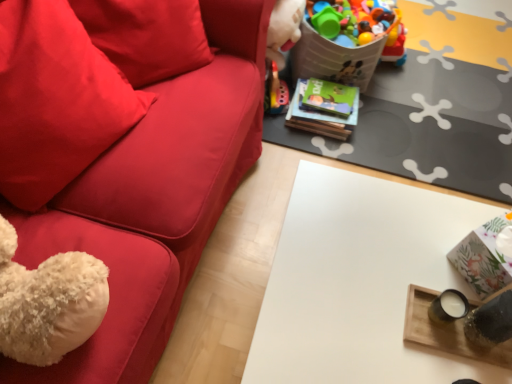
The height and width of the screenshot is (384, 512). What do you see at coordinates (360, 282) in the screenshot? I see `white glossy table at center` at bounding box center [360, 282].

You are a GUI agent. You are given a task and a screenshot of the screen. Output one action in this format:
    pyautogui.click(x=<x>, y=<y>)
    Task: Click on the white glossy table at center
    The height and width of the screenshot is (384, 512).
    Given the screenshot: What is the action you would take?
    pyautogui.click(x=360, y=282)

Where is `velvety red pillow at left`? This screenshot has height=384, width=512. velvety red pillow at left is located at coordinates (55, 100).

The height and width of the screenshot is (384, 512). What do you see at coordinates (55, 100) in the screenshot? I see `velvety red pillow at left` at bounding box center [55, 100].

Measure the distance between velvety red pillow at left and camera.

35.15 inches.

Find the location of a particular element. white glossy table at center is located at coordinates (360, 282).

Considering the relative positions of velvety red pillow at left and white glossy table at center in the image provided, is velvety red pillow at left to the left or to the right of white glossy table at center?

Based on their positions, velvety red pillow at left is located to the left of white glossy table at center.

Between velvety red pillow at left and white glossy table at center, which one is positioned behind?

white glossy table at center.

Considering the positions of point (103, 87) and point (471, 293), is point (103, 87) closer or farther from the camera than point (471, 293)?

Point (103, 87) is farther from the camera than point (471, 293).

From the image's perspective, which one is positioned higher, velvety red pillow at left or white glossy table at center?

velvety red pillow at left is shown above in the image.

From a real-world perspective, between velvety red pillow at left and white glossy table at center, who is vertically higher?

In real-world perspective, velvety red pillow at left is above.

In the scene shown: Considering the sizes of velvety red pillow at left and white glossy table at center in the image, is velvety red pillow at left wider or thinner than white glossy table at center?

In the image, velvety red pillow at left appears to be more narrow than white glossy table at center.

Considering the sizes of velvety red pillow at left and white glossy table at center in the image, is velvety red pillow at left taller or shorter than white glossy table at center?

In the image, velvety red pillow at left appears to be shorter than white glossy table at center.

Which of these two, velvety red pillow at left or white glossy table at center, is smaller?

Smaller between the two is velvety red pillow at left.

Is velvety red pillow at left positioned beyond the bounds of white glossy table at center?

velvety red pillow at left is positioned outside white glossy table at center.

In the scene shown: Is velvety red pillow at left not near white glossy table at center?

No, there isn't a large distance between velvety red pillow at left and white glossy table at center.

Is velvety red pillow at left facing towards white glossy table at center?

Yes, velvety red pillow at left is turned towards white glossy table at center.

At what (x,y) coordinates should I click in order to perform the action: click on table that appears below the velvety red pillow at left (from the image's perspective). Please return your answer as a coordinate pair (x, y). This screenshot has width=512, height=384. Looking at the image, I should click on (360, 282).

From the picture: Can you confirm if white glossy table at center is positioned to the left of velvety red pillow at left?

No.

Who is more distant, white glossy table at center or velvety red pillow at left?

white glossy table at center.

Is point (318, 266) positioned after point (115, 89)?

No, it is in front of (115, 89).

From the image's perspective, is white glossy table at center above or below velvety red pillow at left?

white glossy table at center is situated lower than velvety red pillow at left in the image.

From a real-world perspective, is white glossy table at center on top of velvety red pillow at left?

Actually, white glossy table at center is physically below velvety red pillow at left in the real world.

Considering the sizes of objects white glossy table at center and velvety red pillow at left in the image provided, who is wider, white glossy table at center or velvety red pillow at left?

white glossy table at center.

Considering the sizes of objects white glossy table at center and velvety red pillow at left in the image provided, who is shorter, white glossy table at center or velvety red pillow at left?

velvety red pillow at left.

Does white glossy table at center have a larger size compared to velvety red pillow at left?

Correct, white glossy table at center is larger in size than velvety red pillow at left.

Is white glossy table at center not inside velvety red pillow at left?

Yes.

Is white glossy table at center far away from velvety red pillow at left?

That's not correct — white glossy table at center is a little close to velvety red pillow at left.

Is white glossy table at center aimed at velvety red pillow at left?

No, white glossy table at center does not turn towards velvety red pillow at left.

This screenshot has width=512, height=384. I want to click on table located on the right of velvety red pillow at left, so click(x=360, y=282).

Identify the location of pillow that appears above the white glossy table at center (from a real-world perspective). This screenshot has width=512, height=384. (55, 100).

Where is `table below the velvety red pillow at left (from the image's perspective)`? This screenshot has width=512, height=384. table below the velvety red pillow at left (from the image's perspective) is located at coordinates (360, 282).